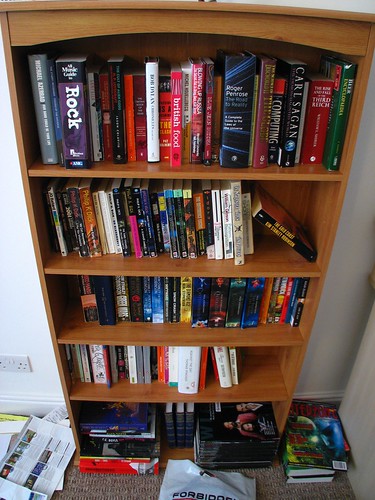
Locate an element on the screen. Image resolution: width=375 pixels, height=500 pixels. shelves is located at coordinates (174, 456), (163, 396), (164, 334), (164, 270), (168, 169).